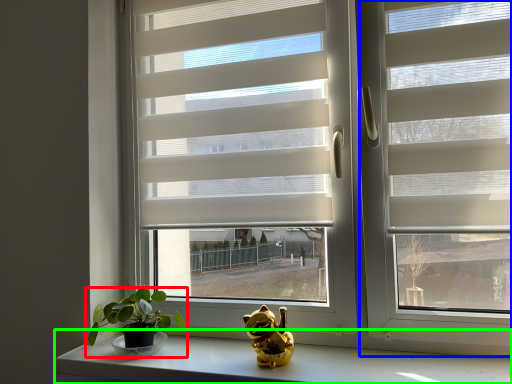
Question: Which object is positioned farthest from houseplant (highlighted by a red box)? Select from screen door (highlighted by a blue box) and counter top (highlighted by a green box).

Choices:
 (A) screen door
 (B) counter top

Answer: (A)